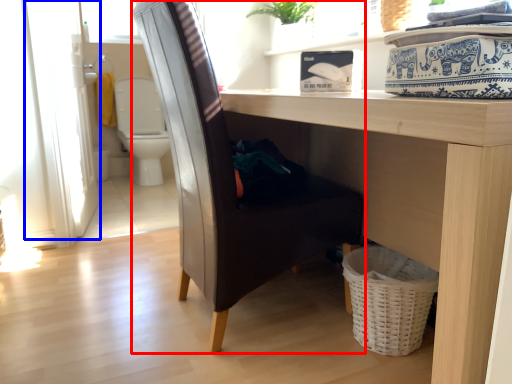
Question: Which of the following is the closest to the observer, chair (highlighted by a red box) or screen door (highlighted by a blue box)?

Choices:
 (A) chair
 (B) screen door

Answer: (A)